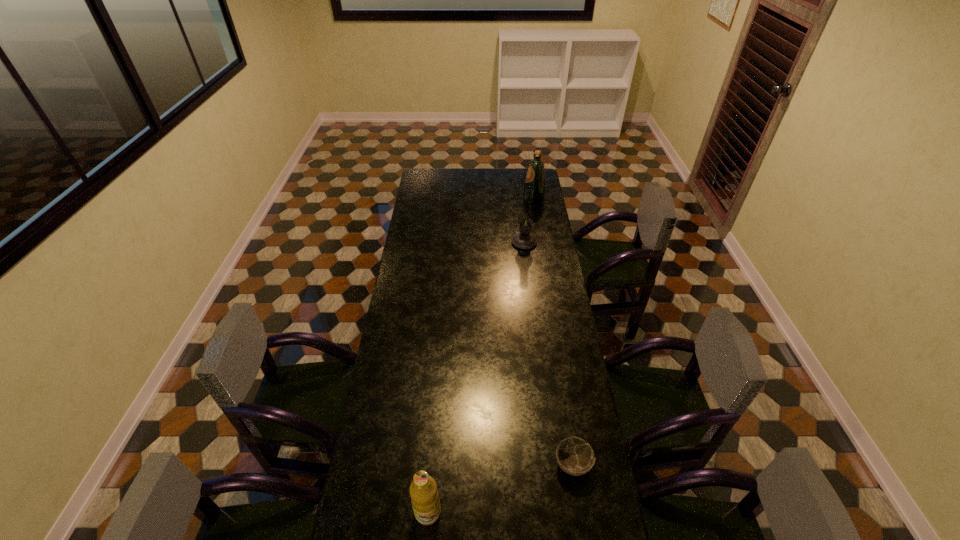
Image resolution: width=960 pixels, height=540 pixels. Identify the location of oil lamp. (524, 240).

Image resolution: width=960 pixels, height=540 pixels. In order to click on the farther olive oil in this screenshot , I will do `click(535, 178)`.

Find the location of `the farthest object`. the farthest object is located at coordinates (535, 178).

Find the location of a particular element. the shorter olive oil is located at coordinates (424, 495).

I want to click on the nearer olive oil, so click(424, 495).

This screenshot has height=540, width=960. In order to click on bowl in this screenshot , I will do `click(574, 456)`.

At what (x,y) coordinates should I click in order to perform the action: click on the shortest object. Please return your answer as a coordinate pair (x, y). The width and height of the screenshot is (960, 540). Looking at the image, I should click on (574, 456).

Where is `vacant area situated on the back of the third nearest object`? vacant area situated on the back of the third nearest object is located at coordinates (518, 196).

The width and height of the screenshot is (960, 540). In order to click on vacant space positioned 0.090m on the front-facing side of the farthest object in this screenshot , I will do `click(508, 198)`.

You are a GUI agent. You are given a task and a screenshot of the screen. Output one action in this format:
    pyautogui.click(x=<x>, y=<y>)
    Task: Click on the vacant area situated 0.370m on the front-facing side of the farthest object
    The height and width of the screenshot is (540, 960).
    Given the screenshot: What is the action you would take?
    pyautogui.click(x=460, y=198)